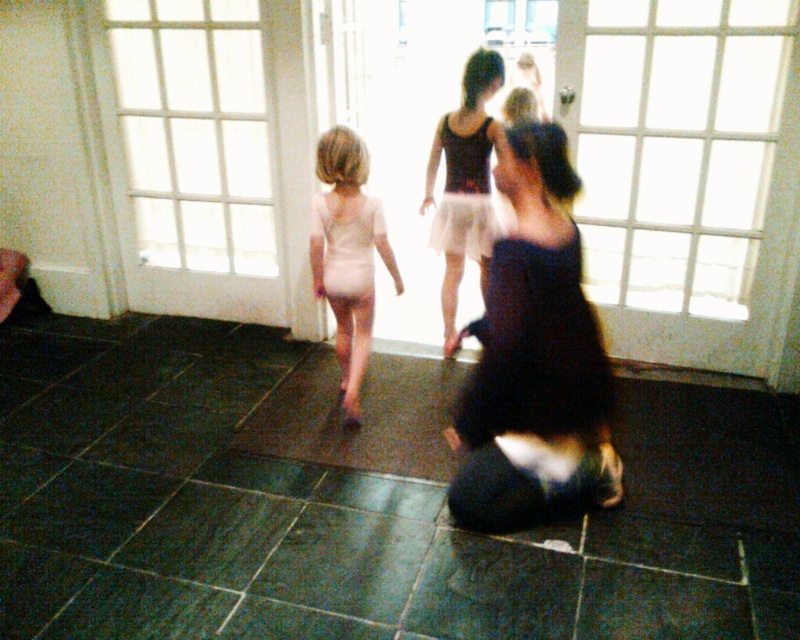
You are a photographer setting up a shoot in the room described. You need to ensure that both the white matte leotard at center and the matte black leotard at center are fully visible in the frame. Given their sizes, which leotard might require more space to accommodate its width?

The white matte leotard at center has a larger width than the matte black leotard at center, so it would require more space to accommodate its width.

You are a photographer setting up for a photoshoot in the room described. You need to ensure that both the white matte leotard at center and the matte black leotard at center are clearly visible in the frame. Considering their sizes, which leotard might require more lighting adjustments to ensure visibility?

The white matte leotard at center is bigger than the matte black leotard at center. Since white reflects more light, the white matte leotard at center might require more lighting adjustments to prevent overexposure and ensure details are visible.